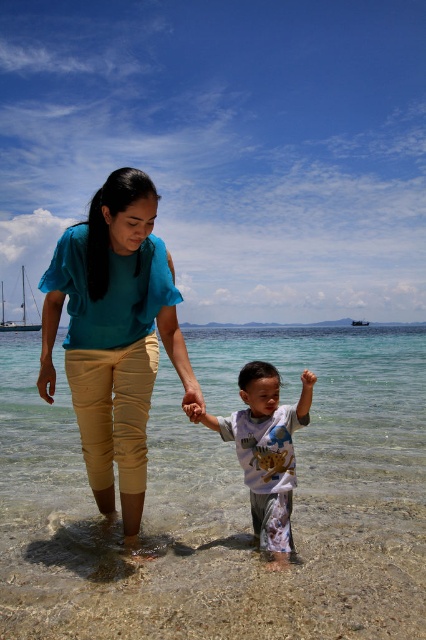
Can you confirm if clear water at child right is bigger than teal fabric shirt at center?

Yes, clear water at child right is bigger than teal fabric shirt at center.

Between clear water at child right and teal fabric shirt at center, which one is positioned lower?

Positioned lower is clear water at child right.

Which is in front, point (389, 499) or point (97, 460)?

Point (97, 460) is more forward.

I want to click on clear water at child right, so click(334, 400).

Is teal fabric shirt at center to the left of white cotton shirt at center from the viewer's perspective?

Correct, you'll find teal fabric shirt at center to the left of white cotton shirt at center.

This screenshot has height=640, width=426. What do you see at coordinates (114, 333) in the screenshot? I see `teal fabric shirt at center` at bounding box center [114, 333].

Locate an element on the screen. teal fabric shirt at center is located at coordinates (114, 333).

Which is in front, point (370, 444) or point (253, 456)?

Point (253, 456) is in front.

Who is more forward, (166,432) or (299,408)?

Point (299,408) is in front.

The height and width of the screenshot is (640, 426). What are the coordinates of `clear water at child right` in the screenshot? It's located at (334, 400).